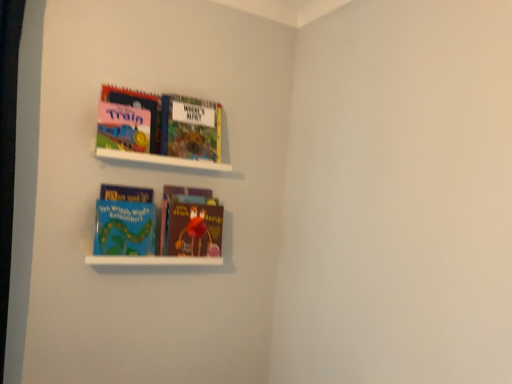
Question: Is brown matte book at center, acting as the 4th book starting from the top, bigger or smaller than blue matte book at lower left, which appears as the second book when ordered from the bottom?

Choices:
 (A) small
 (B) big

Answer: (B)

Question: In the image, is brown matte book at center, placed as the first book when sorted from bottom to top, positioned in front of or behind blue matte book at lower left, the third book from the top?

Choices:
 (A) front
 (B) behind

Answer: (B)

Question: Estimate the real-world distances between objects in this image. Which object is farther from the blue matte book at lower left, which appears as the second book when ordered from the bottom?

Choices:
 (A) white matte bookshelf at upper center, the first cabinet from the top
 (B) white matte shelf at lower center, positioned as the second cabinet in top-to-bottom order
 (C) matte pink board book at upper left, the 1th book positioned from the top
 (D) hardcover book at upper center, the 2th book viewed from the top
 (E) brown matte book at center, acting as the 4th book starting from the top

Answer: (D)

Question: Which object is the farthest from the blue matte book at lower left, the third book from the top?

Choices:
 (A) white matte shelf at lower center, positioned as the second cabinet in top-to-bottom order
 (B) hardcover book at upper center, the 3th book from the bottom
 (C) brown matte book at center, acting as the 4th book starting from the top
 (D) matte pink board book at upper left, the 1th book positioned from the top
 (E) white matte bookshelf at upper center, placed as the 2th cabinet when sorted from bottom to top

Answer: (B)